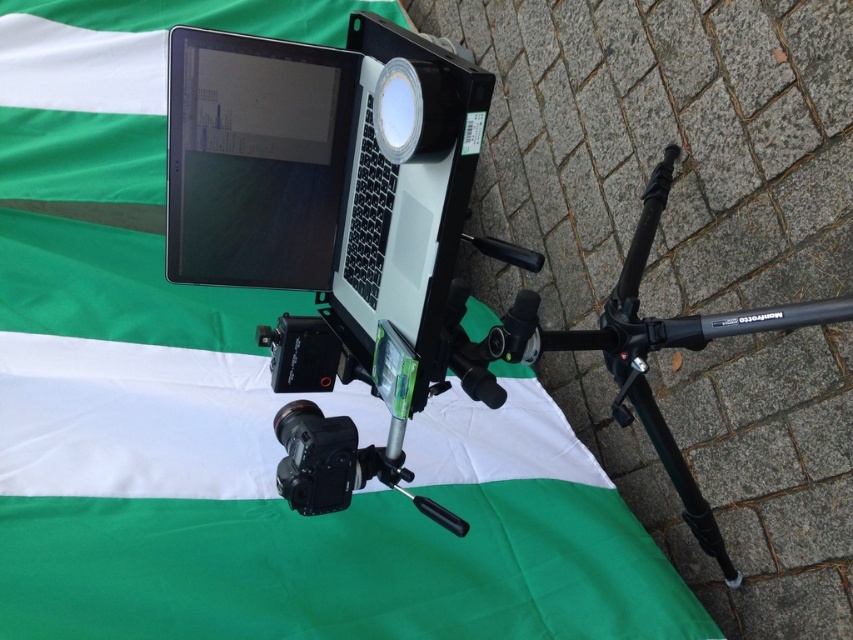
Is the position of matte black laptop at upper center more distant than that of black matte tripod at center?

Yes.

Which is more to the right, matte black laptop at upper center or black matte tripod at center?

Positioned to the right is black matte tripod at center.

You are a GUI agent. You are given a task and a screenshot of the screen. Output one action in this format:
    pyautogui.click(x=<x>, y=<y>)
    Task: Click on the matte black laptop at upper center
    
    Given the screenshot: What is the action you would take?
    pyautogui.click(x=117, y=168)

Find the location of `matte black laptop at upper center`. matte black laptop at upper center is located at coordinates (117, 168).